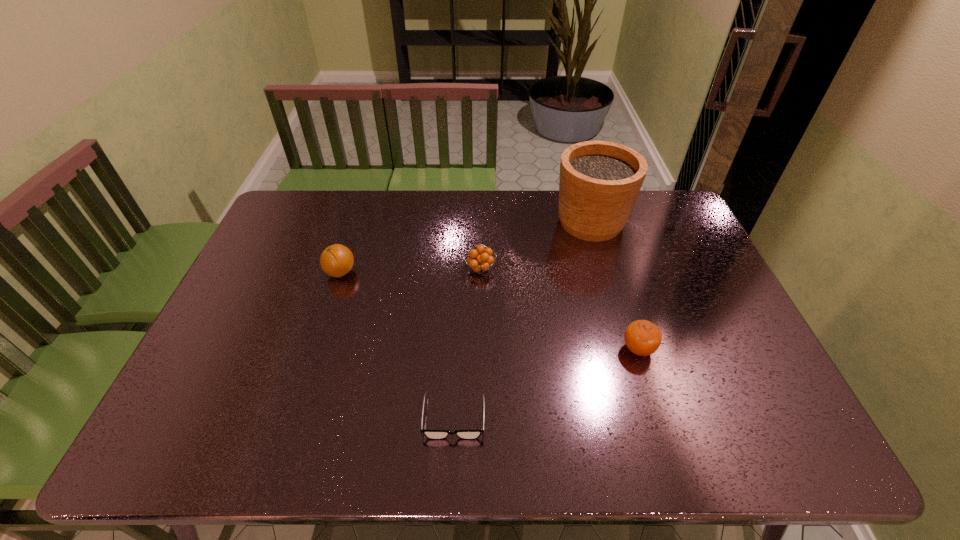
I want to click on the farthest object, so click(x=599, y=183).

In order to click on the tallest object in this screenshot , I will do `click(599, 183)`.

Locate an element on the screen. This screenshot has width=960, height=540. the leftmost orange fruit is located at coordinates (337, 260).

Locate an element on the screen. The height and width of the screenshot is (540, 960). the nearest orange fruit is located at coordinates (643, 338).

Image resolution: width=960 pixels, height=540 pixels. I want to click on the fourth farthest object, so click(643, 338).

Locate an element on the screen. the second orange fruit from right to left is located at coordinates (480, 263).

This screenshot has height=540, width=960. What are the coordinates of `the shortest orange fruit` in the screenshot? It's located at (480, 263).

The image size is (960, 540). In order to click on the shortest object in this screenshot , I will do `click(430, 434)`.

You are a GUI agent. You are given a task and a screenshot of the screen. Output one action in this format:
    pyautogui.click(x=<x>, y=<y>)
    Task: Click on the nearest object
    
    Given the screenshot: What is the action you would take?
    pyautogui.click(x=430, y=434)

Identify the location of free region located on the right of the tallest object. (675, 222).